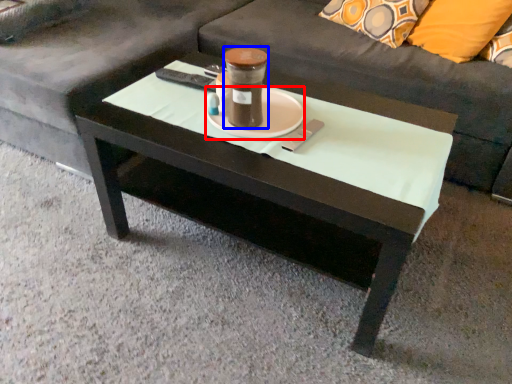
Question: Which point is closer to the camera, saucer (highlighted by a red box) or beverage (highlighted by a blue box)?

Choices:
 (A) saucer
 (B) beverage

Answer: (B)